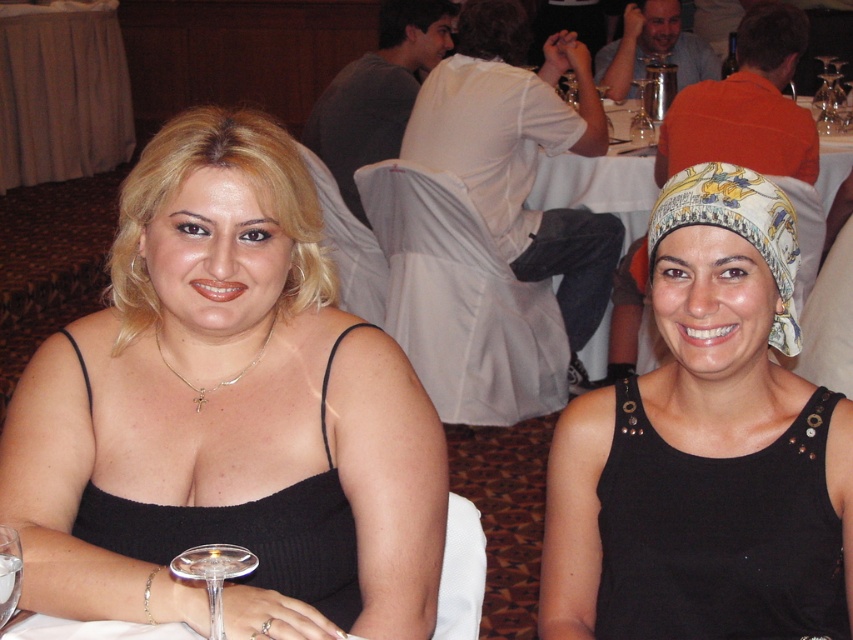
Does printed silk headscarf at center have a smaller size compared to transparent glass at lower left?

No, printed silk headscarf at center is not smaller than transparent glass at lower left.

Is printed silk headscarf at center bigger than transparent glass at lower left?

Yes.

Between point (767, 524) and point (13, 536), which one is positioned behind?

The point (767, 524) is more distant.

This screenshot has height=640, width=853. I want to click on printed silk headscarf at center, so pos(706,449).

Which is in front, point (775, 346) or point (650, 118)?

Point (775, 346) is more forward.

From the picture: Is printed silk headscarf at center positioned before transparent glass at upper center?

Yes, printed silk headscarf at center is closer to the viewer.

Locate an element on the screen. printed silk headscarf at center is located at coordinates (706, 449).

This screenshot has width=853, height=640. In order to click on printed silk headscarf at center in this screenshot , I will do `click(706, 449)`.

Can you confirm if black matte tank top at center is positioned above transparent glass at lower left?

Correct, black matte tank top at center is located above transparent glass at lower left.

Is black matte tank top at center wider than transparent glass at lower left?

Yes.

You are a GUI agent. You are given a task and a screenshot of the screen. Output one action in this format:
    pyautogui.click(x=<x>, y=<y>)
    Task: Click on the black matte tank top at center
    The height and width of the screenshot is (640, 853).
    Given the screenshot: What is the action you would take?
    click(225, 413)